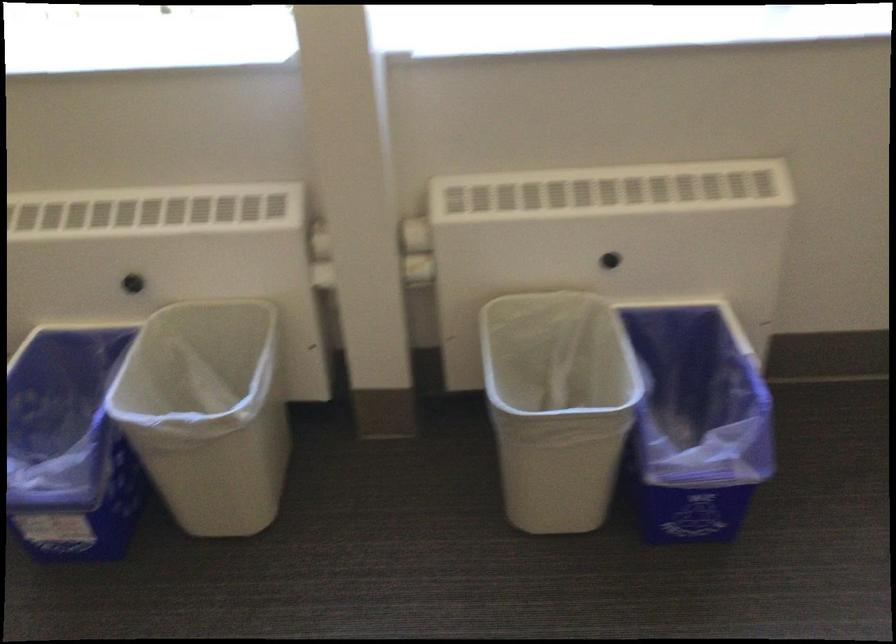
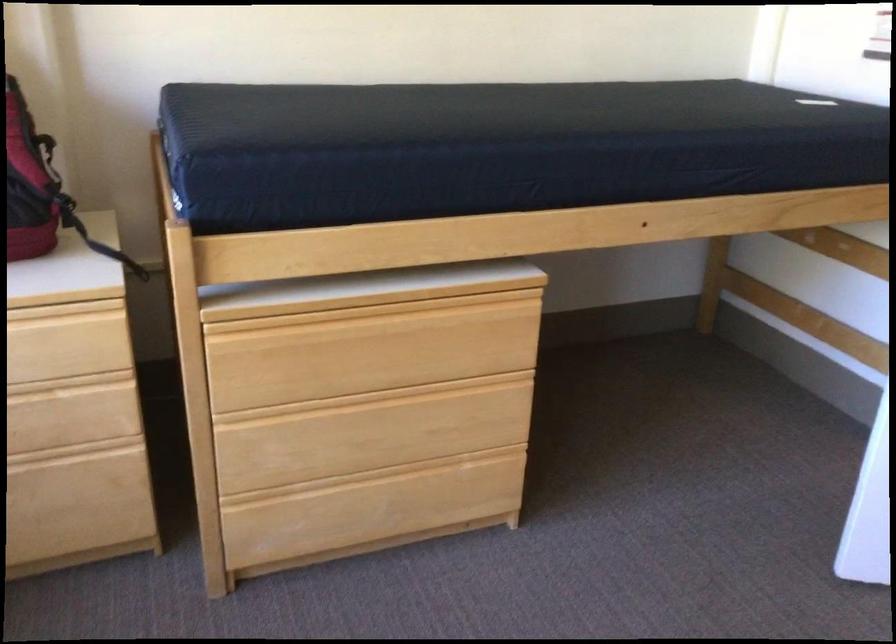
Based on the continuous images, in which direction is the camera rotating?

The camera rotated toward right-down.